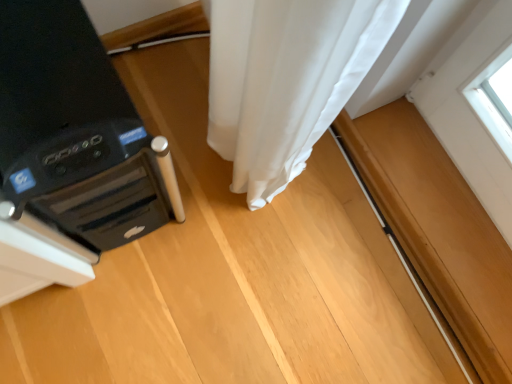
Identify the location of free space in front of black plastic speaker at left. The image size is (512, 384). (101, 322).